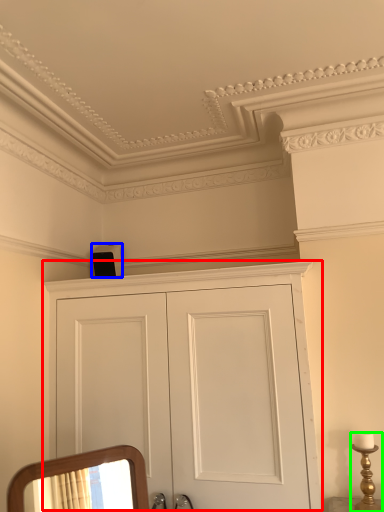
Question: Which object is the closest to the cupboard (highlighted by a red box)? Choose among these: speaker (highlighted by a blue box) or candle holder (highlighted by a green box).

Choices:
 (A) speaker
 (B) candle holder

Answer: (B)